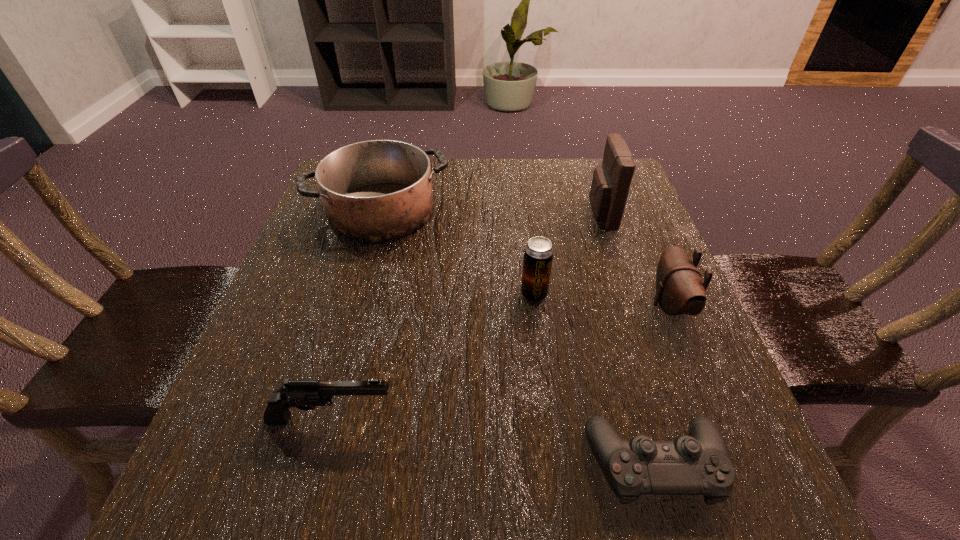
In the image, there is a desktop. Find the location of `vacant region at the near left corner`. vacant region at the near left corner is located at coordinates pyautogui.click(x=263, y=477).

The image size is (960, 540). What are the coordinates of `free space at the far right corner of the desktop` in the screenshot? It's located at click(x=587, y=195).

This screenshot has width=960, height=540. In order to click on vacant space at the near right corner of the desktop in this screenshot , I will do `click(693, 517)`.

You are a GUI agent. You are given a task and a screenshot of the screen. Output one action in this format:
    pyautogui.click(x=<x>, y=<y>)
    Task: Click on the free area in between the gun and the shorter pouch
    This screenshot has height=540, width=960.
    Given the screenshot: What is the action you would take?
    pyautogui.click(x=501, y=362)

Identify the location of free area in between the shorter pouch and the control. (662, 385).

Find the location of `vacant space in between the saucepan and the beer can`. vacant space in between the saucepan and the beer can is located at coordinates (458, 252).

Locate an element on the screen. The image size is (960, 540). free space that is in between the gun and the third object from left to right is located at coordinates (433, 356).

Identify the location of free spot between the saucepan and the left pouch. The width and height of the screenshot is (960, 540). (492, 213).

At what (x,y) coordinates should I click in order to perform the action: click on empty space between the saucepan and the tallest object. Please return your answer as a coordinate pair (x, y). This screenshot has width=960, height=540. Looking at the image, I should click on (492, 213).

Image resolution: width=960 pixels, height=540 pixels. Identify the location of free area in between the farther pouch and the third object from left to right. (567, 254).